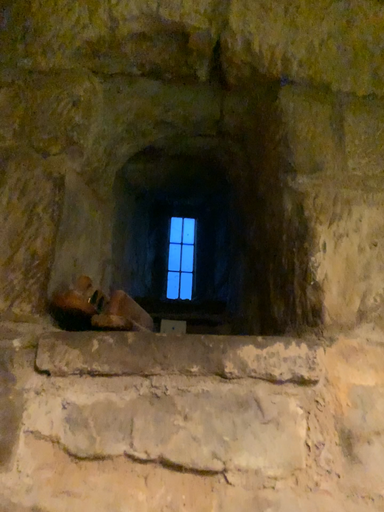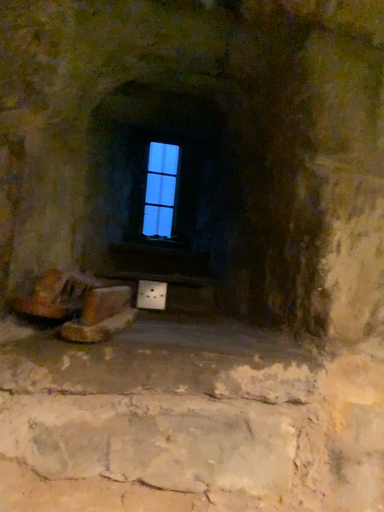
Question: How did the camera likely rotate when shooting the video?

Choices:
 (A) rotated upward
 (B) rotated downward

Answer: (B)